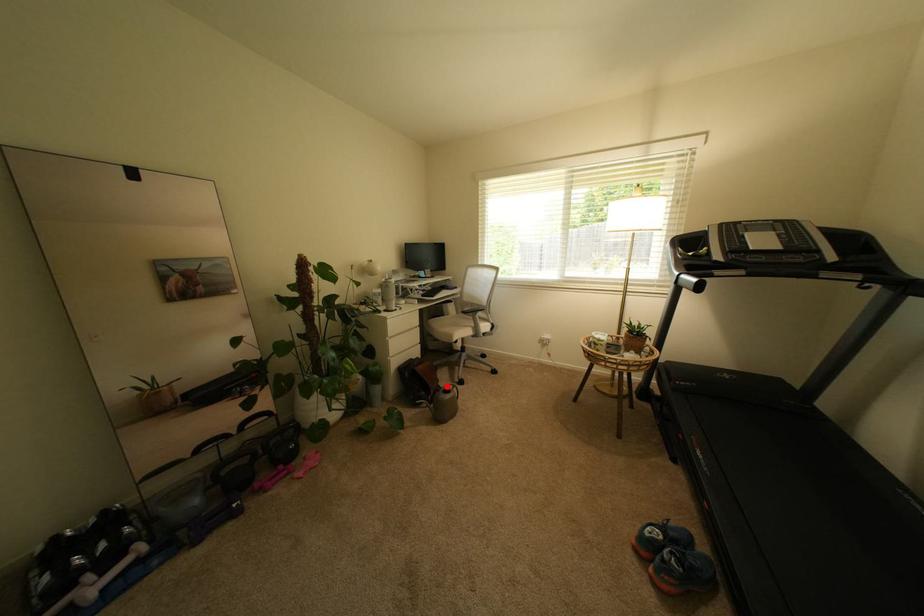
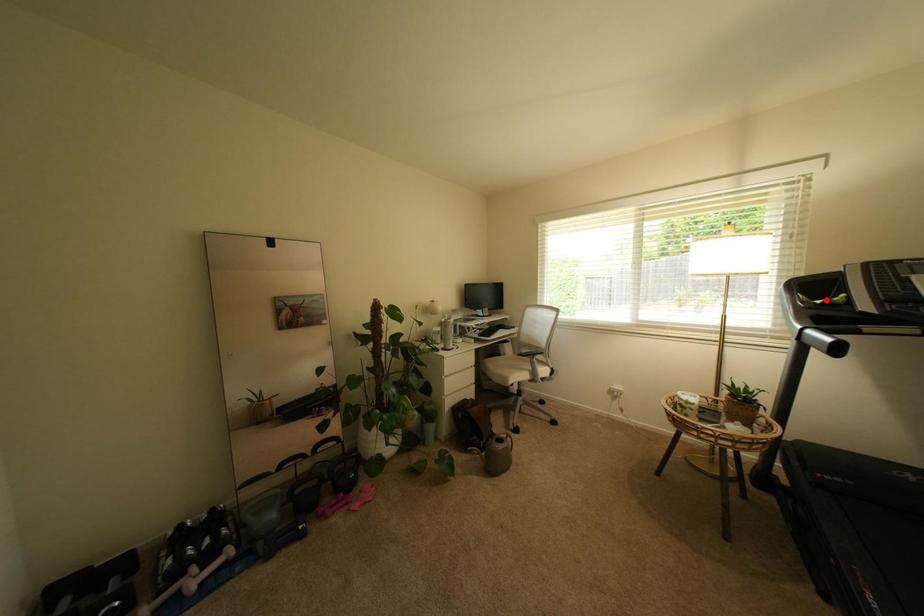
I am providing you with two images of the same scene from different viewpoints. A red point is marked on the first image and another point is marked on the second image. Do the highlighted points in image1 and image2 indicate the same real-world spot?

No